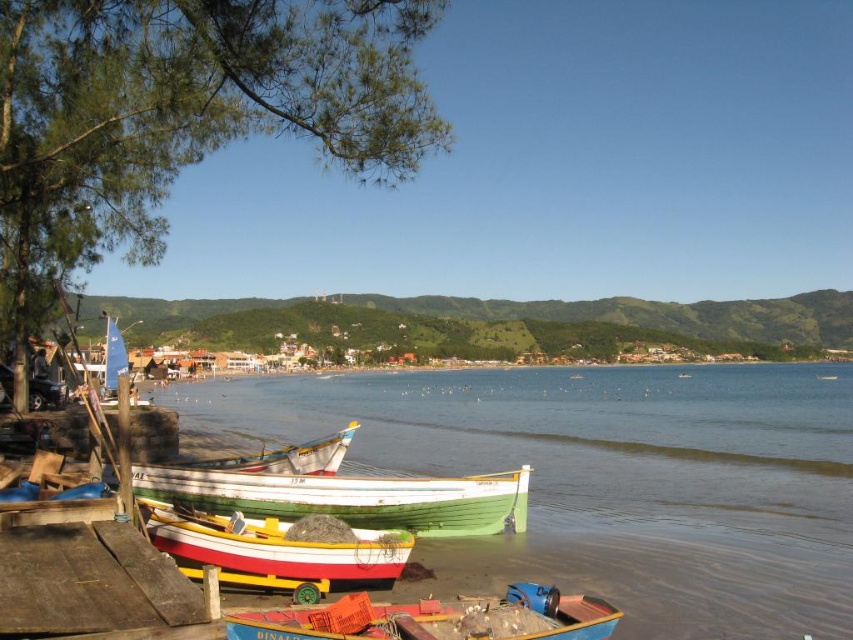
You are standing on the sandy shore and want to board the green wooden boat at center and the white wooden boat at center. Which boat requires taking a longer step from the shore due to its greater width?

The green wooden boat at center might be wider than the white wooden boat at center, so it requires a longer step from the shore.

You are standing at the shore looking at the boats. There are two points marked on the boats. One is at point coordinates point (33, 577) and the other at point coordinates point (180, 500). Which point is closer to you?

Point (33, 577) is closer to the camera than point (180, 500).

You are standing on the beach and see the wooden at lower left and the green wooden boat at center. Which object is positioned to the left of the other?

The wooden at lower left is to the left of the green wooden boat at center.